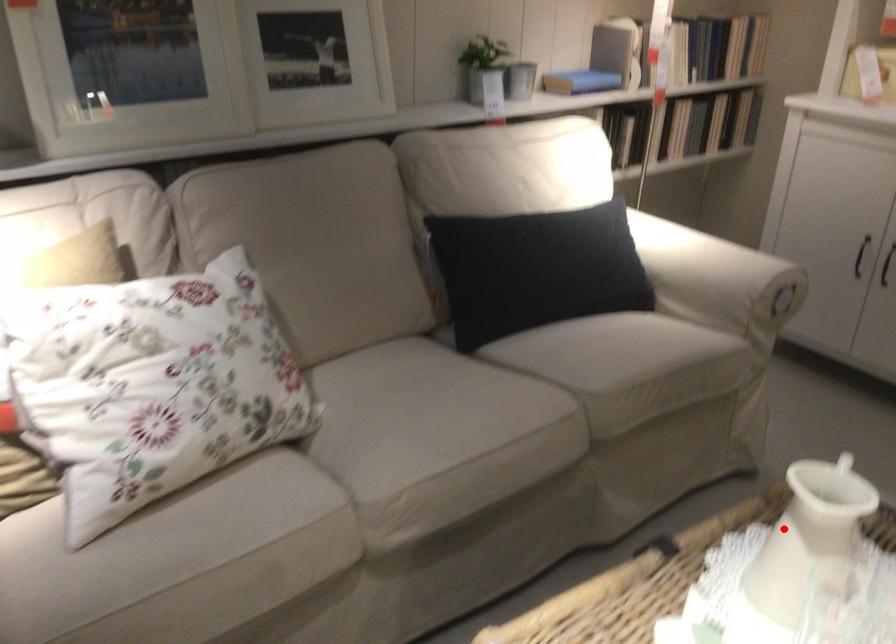
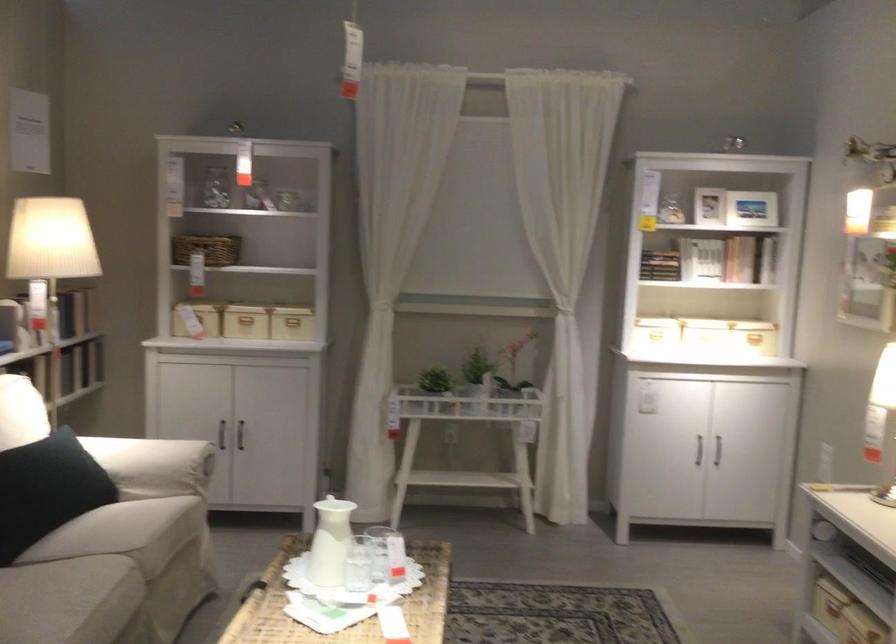
Where in the second image is the point corresponding to the highlighted location from the first image?

(330, 542)